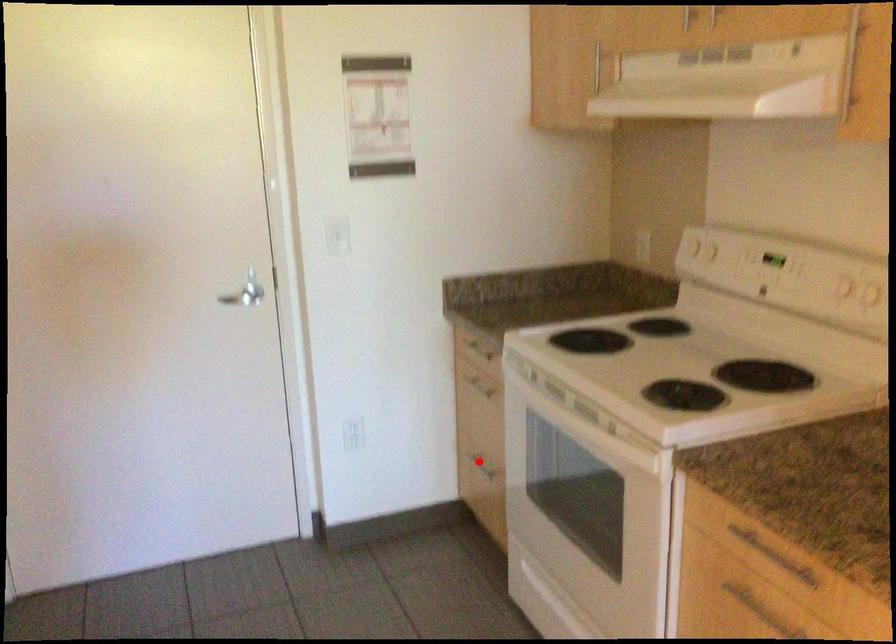
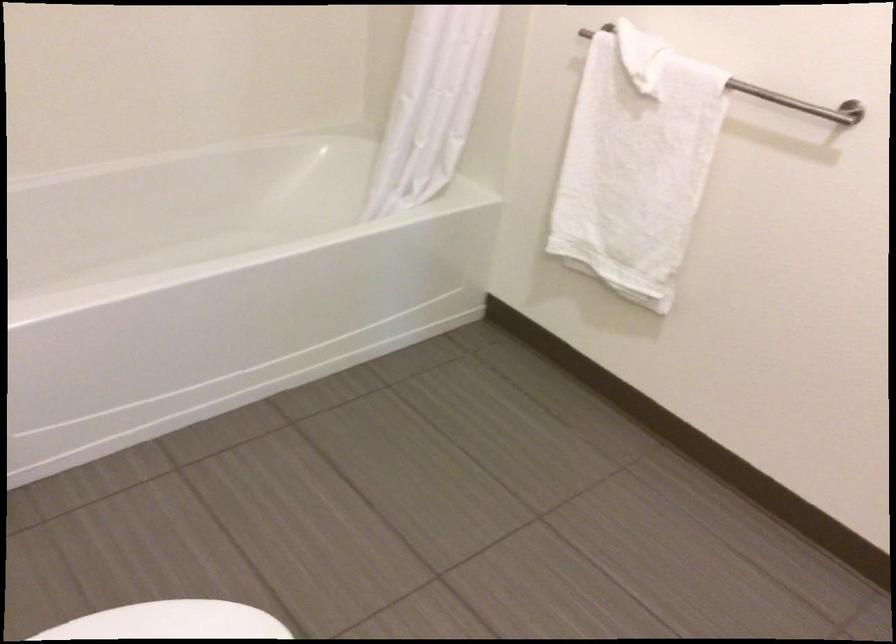
Question: I am providing you with two images of the same scene from different viewpoints. A red point is marked on the first image. At the location where the point appears in image 1, is it still visible in image 2?

Choices:
 (A) Yes
 (B) No

Answer: (B)